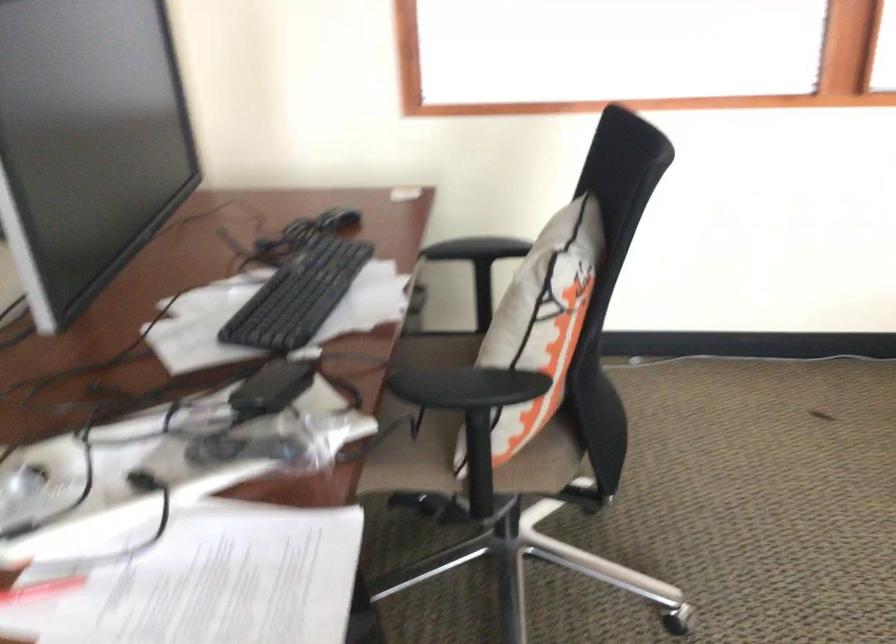
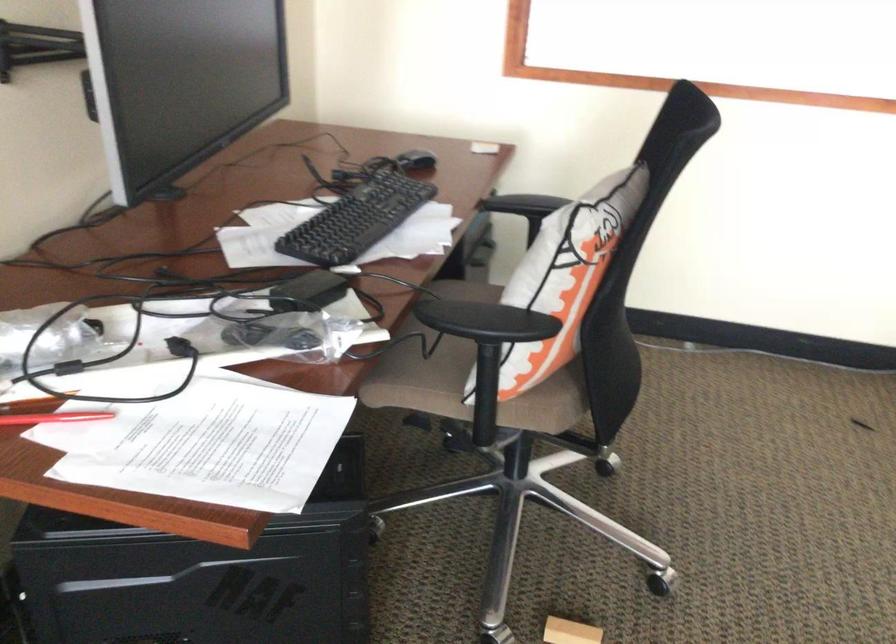
Find the pixel in the second image that matches the point at 298,295 in the first image.

(356, 220)